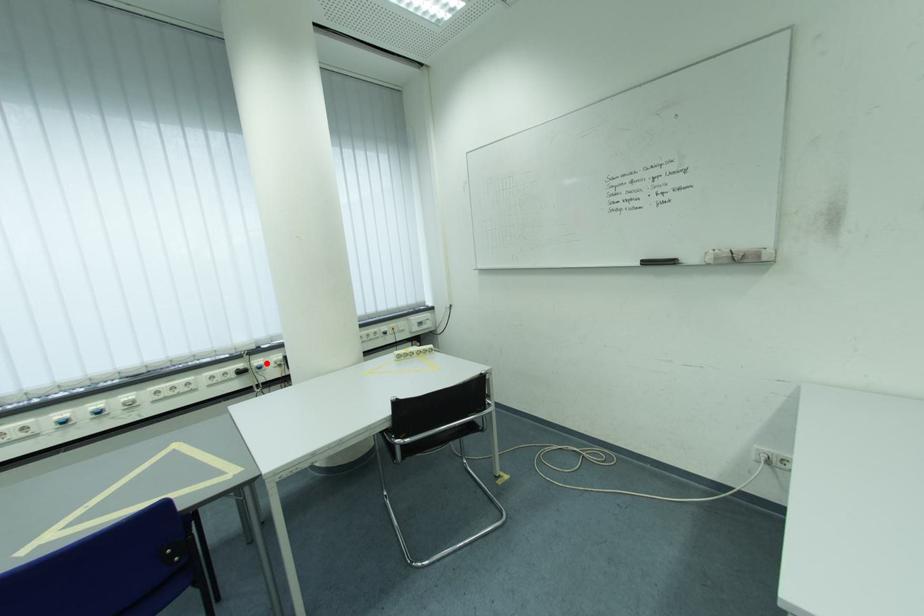
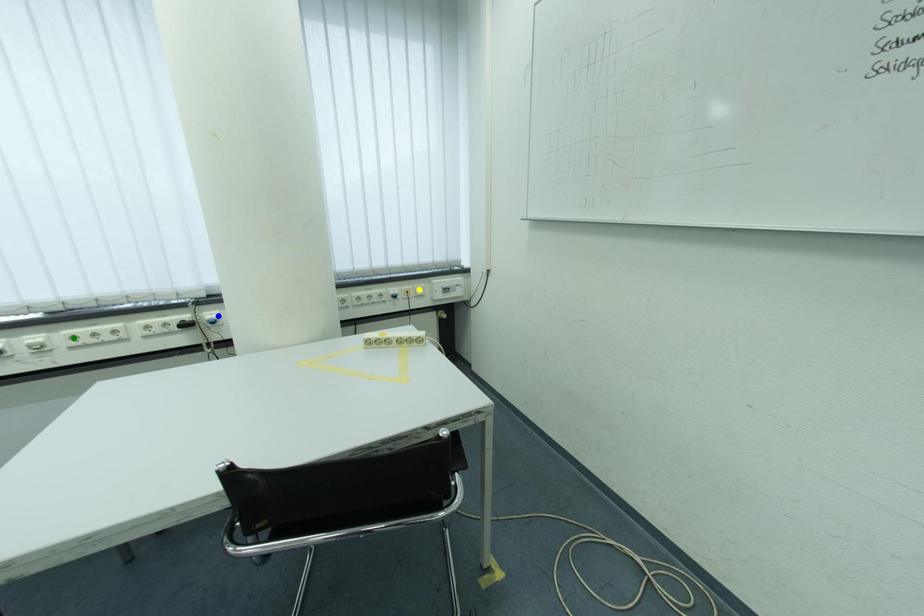
Question: I am providing you with two images of the same scene from different viewpoints. A red point is marked on the first image. You are given multiple points on the second image. Which mark in image 2 goes with the point in image 1?

Choices:
 (A) blue point
 (B) green point
 (C) yellow point

Answer: (A)